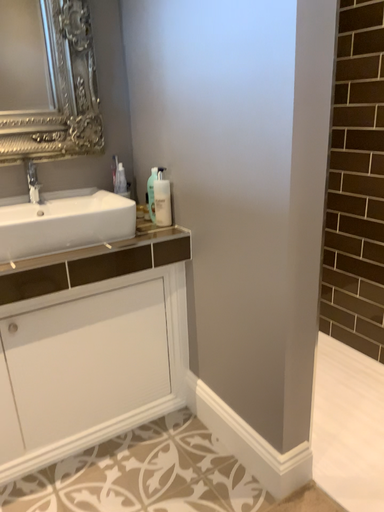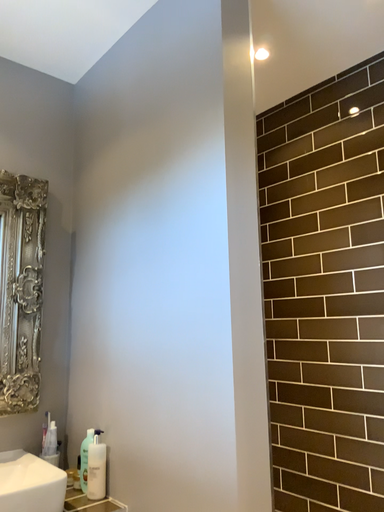
Question: How did the camera likely rotate when shooting the video?

Choices:
 (A) rotated downward
 (B) rotated upward

Answer: (B)